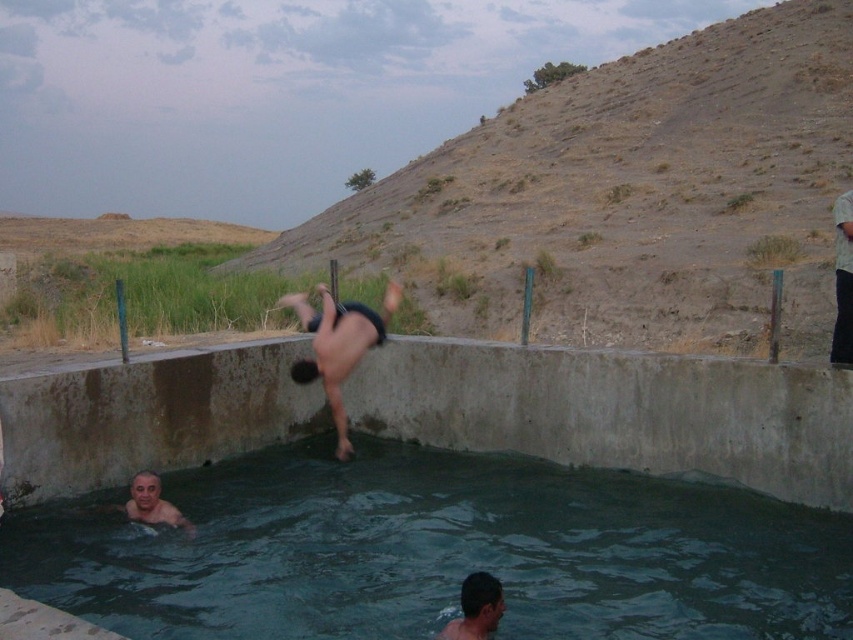
Can you confirm if dull brown dirt at upper center is positioned to the left of smooth skin man at lower left?

Incorrect, dull brown dirt at upper center is not on the left side of smooth skin man at lower left.

You are a GUI agent. You are given a task and a screenshot of the screen. Output one action in this format:
    pyautogui.click(x=<x>, y=<y>)
    Task: Click on the dull brown dirt at upper center
    The height and width of the screenshot is (640, 853).
    Given the screenshot: What is the action you would take?
    coord(628,196)

Does light brown fabric shirt at right lie in front of smooth skin man at lower left?

No, it is behind smooth skin man at lower left.

Between point (849, 344) and point (138, 484), which one is positioned in front?

Positioned in front is point (138, 484).

You are a GUI agent. You are given a task and a screenshot of the screen. Output one action in this format:
    pyautogui.click(x=<x>, y=<y>)
    Task: Click on the light brown fabric shirt at right
    This screenshot has height=640, width=853.
    Given the screenshot: What is the action you would take?
    pyautogui.click(x=842, y=280)

Between dull brown dirt at upper center and smooth skin head at lower center, which one is positioned higher?

dull brown dirt at upper center is above.

Is dull brown dirt at upper center closer to the viewer compared to smooth skin head at lower center?

No.

This screenshot has height=640, width=853. What are the coordinates of `dull brown dirt at upper center` in the screenshot? It's located at (628, 196).